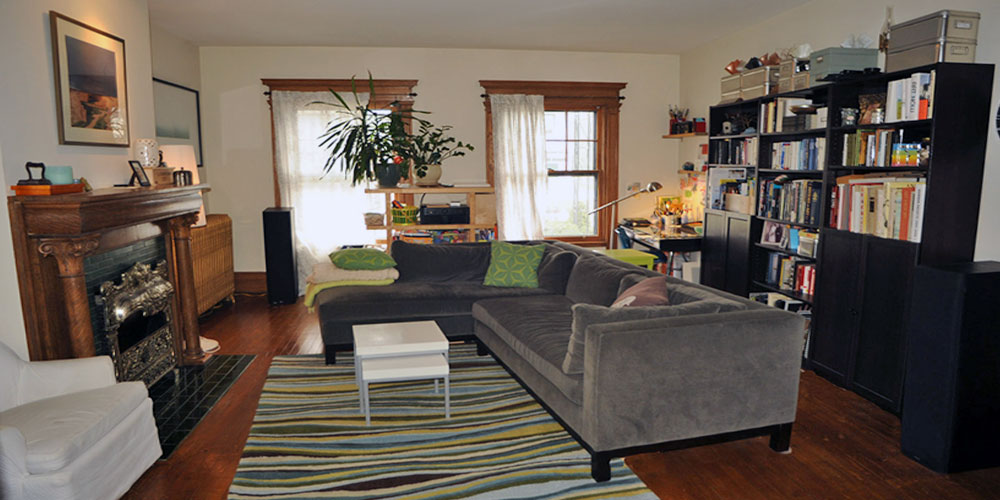
Where is `livingroom`? Image resolution: width=1000 pixels, height=500 pixels. livingroom is located at coordinates (249, 237).